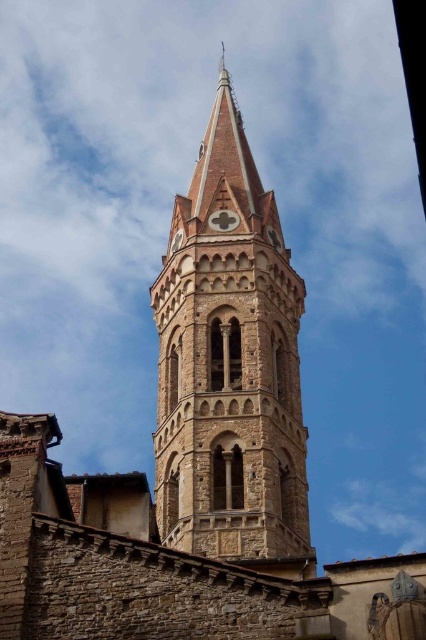
Can you confirm if brown stone tower at center is positioned below matte stone clock at upper center?

No, brown stone tower at center is not below matte stone clock at upper center.

From the picture: Measure the distance from brown stone tower at center to matte stone clock at upper center.

They are 8.56 meters apart.

Between point (224, 330) and point (218, 227), which one is positioned in front?

Point (224, 330) is more forward.

What are the coordinates of `brown stone tower at center` in the screenshot? It's located at (229, 364).